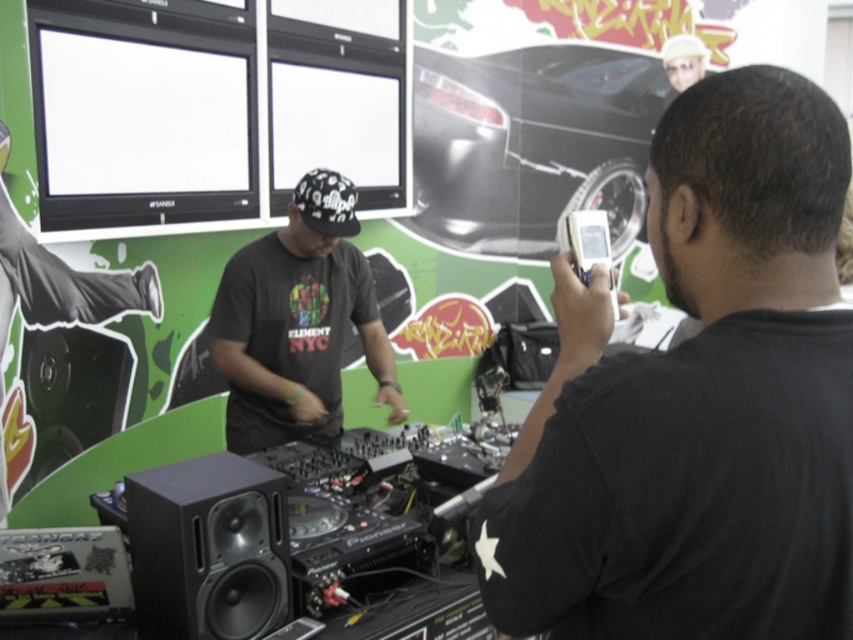
Question: Which point appears closest to the camera in this image?

Choices:
 (A) (503, 548)
 (B) (134, 564)

Answer: (A)

Question: Which object is farther from the camera taking this photo?

Choices:
 (A) black matte speaker at lower left
 (B) black matte t-shirt at center
 (C) black matte shirt at right

Answer: (B)

Question: Can you confirm if black matte shirt at right is positioned to the right of black matte t-shirt at center?

Choices:
 (A) yes
 (B) no

Answer: (A)

Question: Which object is positioned closest to the black matte shirt at right?

Choices:
 (A) black matte speaker at lower left
 (B) black matte t-shirt at center

Answer: (A)

Question: Can you confirm if black matte shirt at right is thinner than black matte t-shirt at center?

Choices:
 (A) yes
 (B) no

Answer: (A)

Question: Is black matte t-shirt at center to the left of black matte speaker at lower left from the viewer's perspective?

Choices:
 (A) no
 (B) yes

Answer: (A)